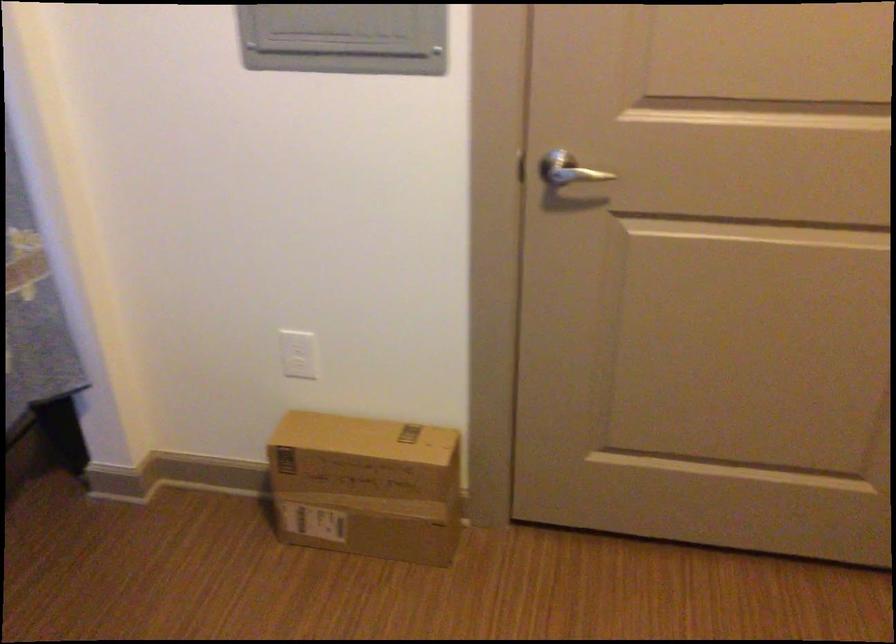
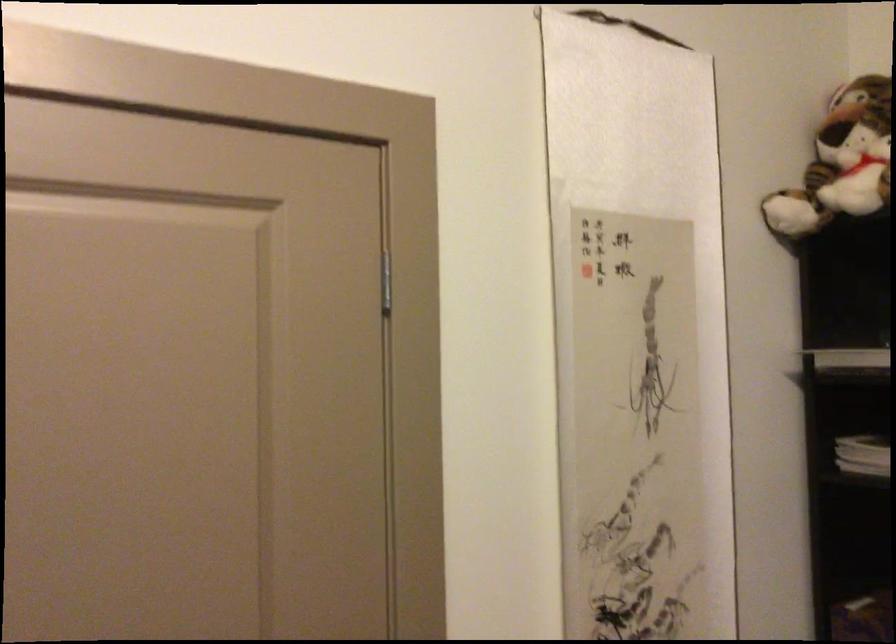
Based on the continuous images, in which direction is the camera rotating?

The rotation direction of the camera is right-up.